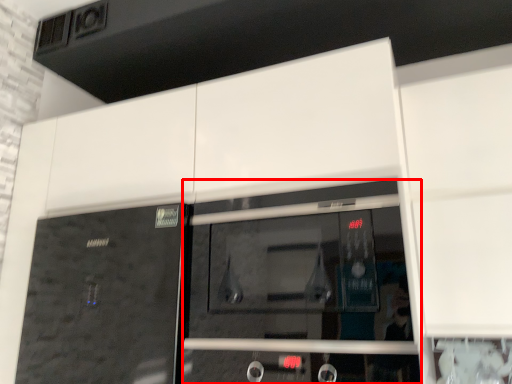
Question: In this image, where is screen door (annotated by the red box) located relative to door?

Choices:
 (A) left
 (B) right

Answer: (B)